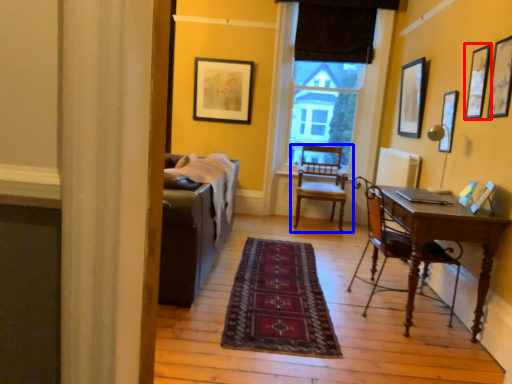
Question: Which point is further to the camera, picture frame (highlighted by a red box) or chair (highlighted by a blue box)?

Choices:
 (A) picture frame
 (B) chair

Answer: (B)